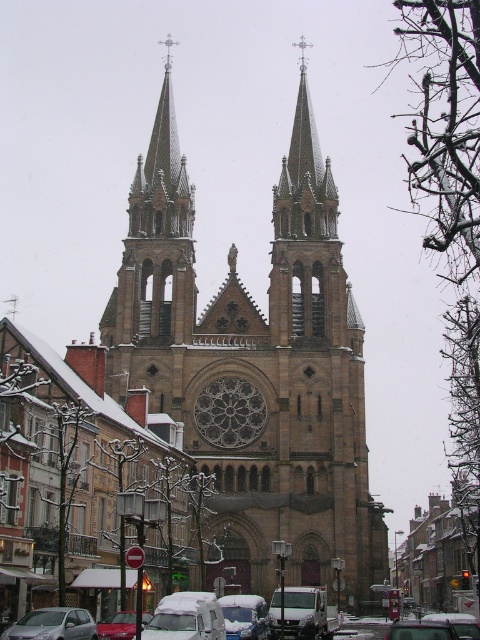
Does metallic silver car at center lie in front of metallic red car at center?

No, metallic silver car at center is behind metallic red car at center.

Between point (452, 632) and point (116, 624), which one is positioned in front?

Point (116, 624)

Is point (415, 621) in front of point (109, 634)?

No, (415, 621) is behind (109, 634).

Where is `metallic silver car at center`? This screenshot has width=480, height=640. metallic silver car at center is located at coordinates (420, 630).

Does white matte car at center lie in front of metallic silver car at center?

Yes.

Does white matte car at center appear over metallic silver car at center?

Indeed, white matte car at center is positioned over metallic silver car at center.

Measure the distance between point (197, 618) and camera.

They are 297.53 feet apart.

You are a GUI agent. You are given a task and a screenshot of the screen. Output one action in this format:
    pyautogui.click(x=<x>, y=<y>)
    Task: Click on the white matte car at center
    The image size is (480, 640).
    Given the screenshot: What is the action you would take?
    pyautogui.click(x=187, y=618)

Is point (7, 636) positioned behind point (110, 628)?

No, it is not.

Is point (63, 627) positioned before point (143, 616)?

Yes, point (63, 627) is in front of point (143, 616).

Measure the distance between point (68, 625) and camera.

Point (68, 625) and camera are 90.74 meters apart from each other.

Identify the location of silver metallic hatchback at center. This screenshot has height=640, width=480. (52, 625).